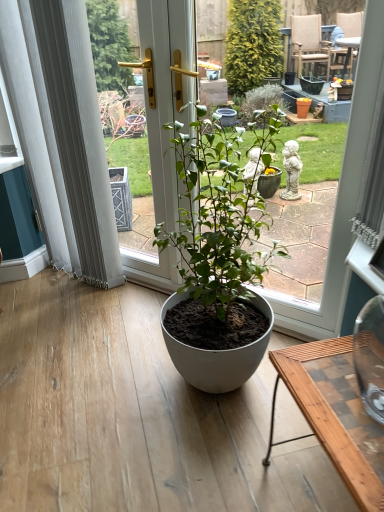
Question: Is the surface of white sheer curtain at left in direct contact with matte white pot at center?

Choices:
 (A) no
 (B) yes

Answer: (A)

Question: From a real-world perspective, is white sheer curtain at left located higher than matte white pot at center?

Choices:
 (A) yes
 (B) no

Answer: (A)

Question: Is white sheer curtain at left to the left of matte white pot at center from the viewer's perspective?

Choices:
 (A) yes
 (B) no

Answer: (A)

Question: Can you confirm if white sheer curtain at left is positioned to the right of matte white pot at center?

Choices:
 (A) yes
 (B) no

Answer: (B)

Question: Could matte white pot at center be considered to be inside white sheer curtain at left?

Choices:
 (A) yes
 (B) no

Answer: (B)

Question: From the image's perspective, is white sheer curtain at left over matte white pot at center?

Choices:
 (A) no
 (B) yes

Answer: (B)

Question: Is white sheer curtain at left positioned behind matte white pot at center?

Choices:
 (A) yes
 (B) no

Answer: (A)

Question: Is white sheer curtain at left positioned far away from matte white pot at center?

Choices:
 (A) no
 (B) yes

Answer: (A)

Question: Considering the relative sizes of white sheer curtain at left and matte white pot at center in the image provided, is white sheer curtain at left smaller than matte white pot at center?

Choices:
 (A) no
 (B) yes

Answer: (B)

Question: Is white sheer curtain at left next to matte white pot at center and touching it?

Choices:
 (A) no
 (B) yes

Answer: (A)

Question: Does white sheer curtain at left appear on the right side of matte white pot at center?

Choices:
 (A) no
 (B) yes

Answer: (A)

Question: From a real-world perspective, is white sheer curtain at left positioned over matte white pot at center based on gravity?

Choices:
 (A) no
 (B) yes

Answer: (B)

Question: Can you see matte white pot at center touching white sheer curtain at left?

Choices:
 (A) no
 (B) yes

Answer: (A)